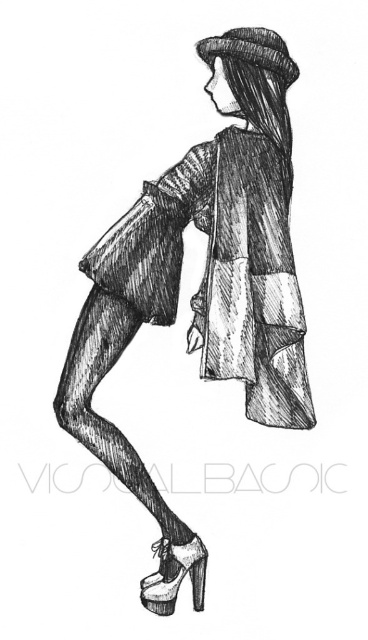
Question: Estimate the real-world distances between objects in this image. Which object is closer to the patchwork fabric dress at center?

Choices:
 (A) matte black coat at center
 (B) white leather high-heeled shoe at lower center
 (C) dark brown textured hat at upper center

Answer: (A)

Question: Does patchwork fabric dress at center appear over white leather high-heeled shoe at lower center?

Choices:
 (A) yes
 (B) no

Answer: (A)

Question: Does matte black coat at center appear on the right side of white leather high-heeled shoe at lower center?

Choices:
 (A) no
 (B) yes

Answer: (B)

Question: Which object appears farthest from the camera in this image?

Choices:
 (A) dark brown textured hat at upper center
 (B) patchwork fabric dress at center

Answer: (B)

Question: Which of the following is the farthest from the observer?

Choices:
 (A) dark brown textured hat at upper center
 (B) patchwork fabric dress at center
 (C) white leather high-heeled shoe at lower center
 (D) matte black coat at center

Answer: (B)

Question: Can you confirm if matte black coat at center is positioned to the left of white leather high-heeled shoe at lower center?

Choices:
 (A) yes
 (B) no

Answer: (B)